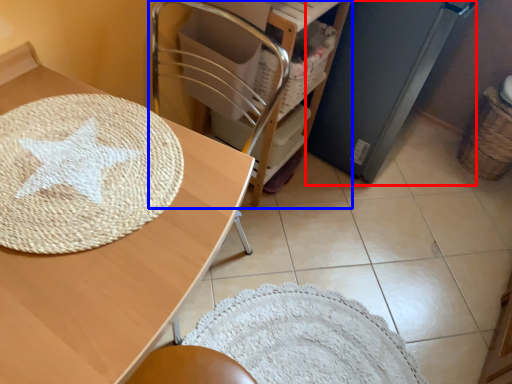
Question: Which point is further to the camera, appliance (highlighted by a red box) or furniture (highlighted by a blue box)?

Choices:
 (A) appliance
 (B) furniture

Answer: (A)